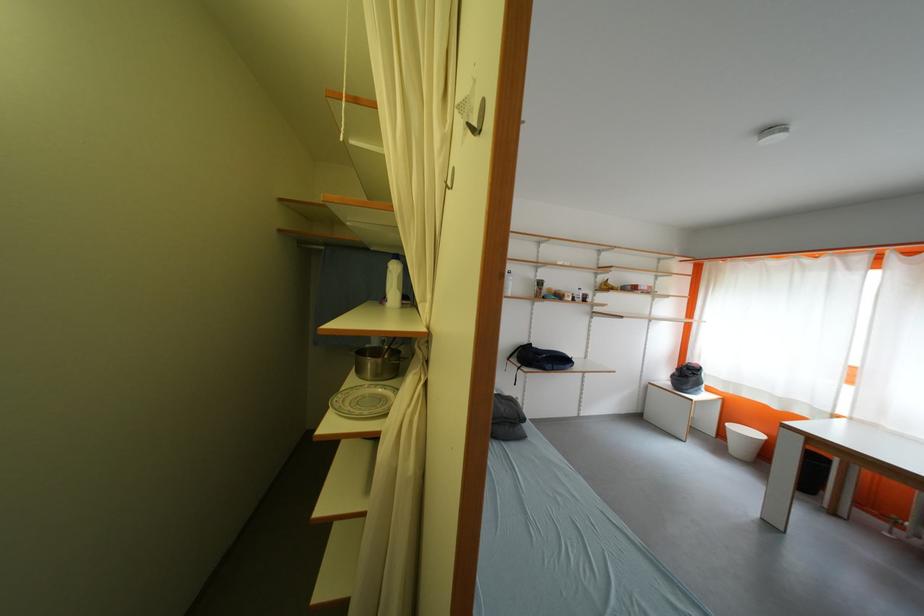
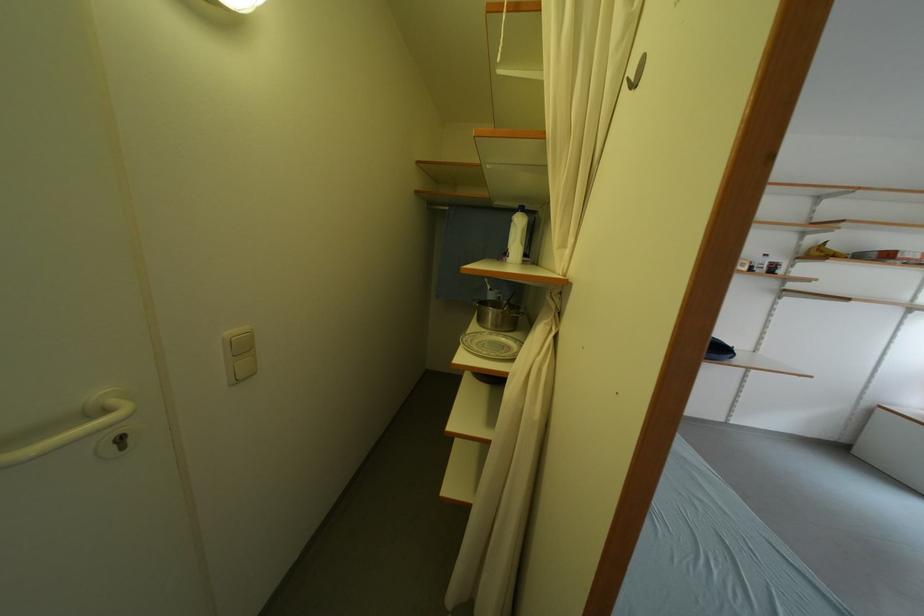
In the second image, find the point that corresponds to [379,366] in the first image.

(500, 317)